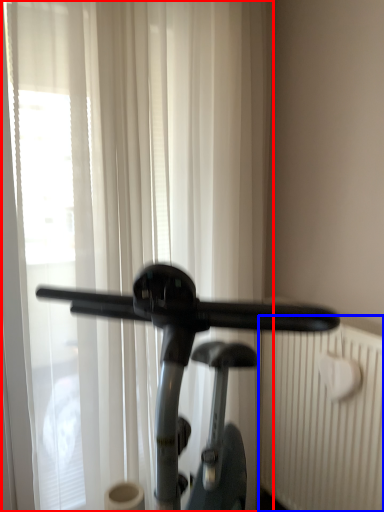
Question: Which object appears farthest to the camera in this image, curtain (highlighted by a red box) or radiator (highlighted by a blue box)?

Choices:
 (A) curtain
 (B) radiator

Answer: (B)